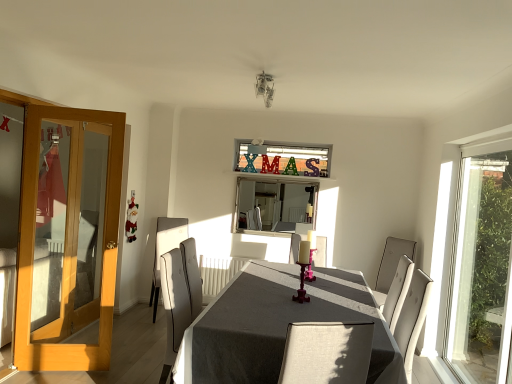
The image size is (512, 384). In order to click on free space to the right of pink glossy candle holder at center in this screenshot , I will do `click(324, 302)`.